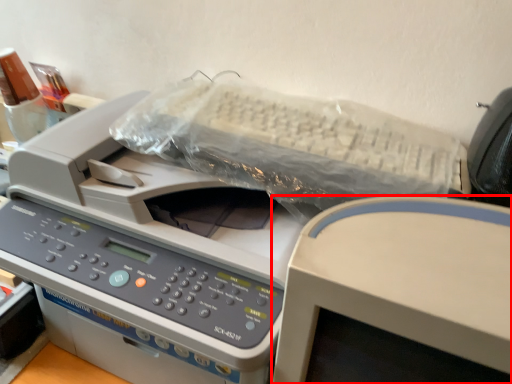
Question: From the image's perspective, what is the correct spatial relationship of office supplies (annotated by the red box) in relation to printer?

Choices:
 (A) above
 (B) below

Answer: (B)